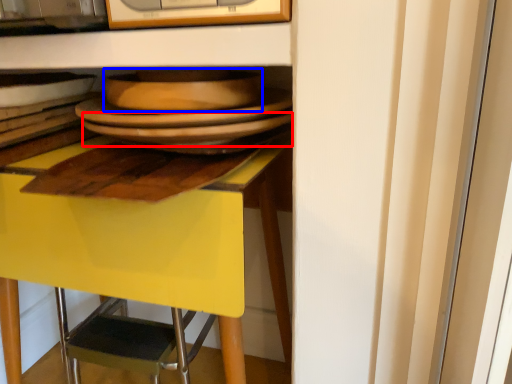
Question: Among these objects, which one is nearest to the camera, plate (highlighted by a red box) or platter (highlighted by a blue box)?

Choices:
 (A) plate
 (B) platter

Answer: (B)